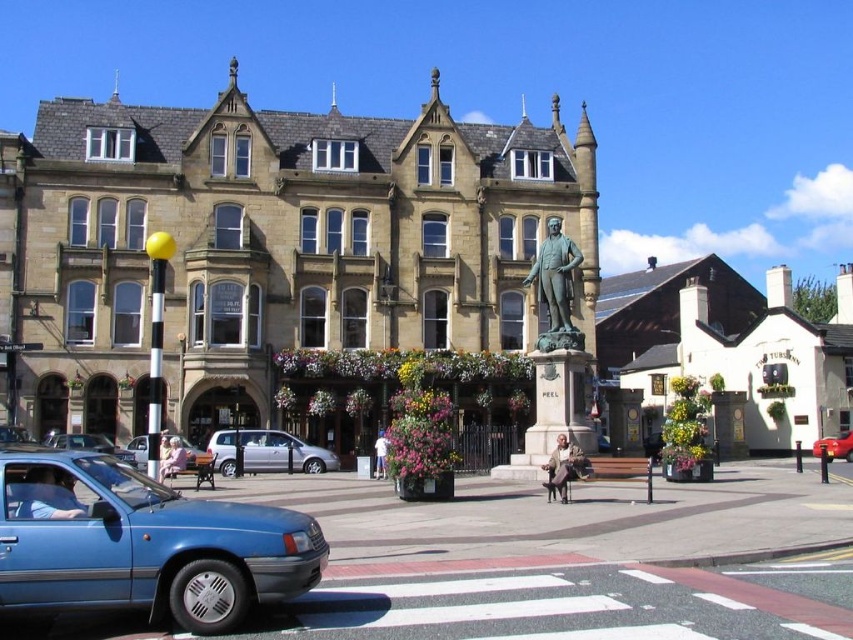
Does bronze statue at center have a greater height compared to blue metallic car at center?

Yes, bronze statue at center is taller than blue metallic car at center.

Describe the element at coordinates (556, 288) in the screenshot. I see `bronze statue at center` at that location.

Identify the location of bronze statue at center. (556, 288).

Is point (554, 340) less distant than point (834, 456)?

Yes, point (554, 340) is closer to viewer.

Locate an element on the screen. bronze statue at center is located at coordinates (556, 288).

Based on the photo, who is more distant from viewer, (572,253) or (816,449)?

Point (816,449)

At what (x,y) coordinates should I click in order to perform the action: click on bronze statue at center. Please return your answer as a coordinate pair (x, y). Looking at the image, I should click on (556, 288).

Is blue metallic car at lower left above blue metallic car at center?

Yes, blue metallic car at lower left is above blue metallic car at center.

Based on the photo, between blue metallic car at lower left and blue metallic car at center, which one is positioned lower?

Positioned lower is blue metallic car at center.

Does point (88, 433) come farther from viewer compared to point (201, 451)?

Yes, it is behind point (201, 451).

At what (x,y) coordinates should I click in order to perform the action: click on blue metallic car at lower left. Please return your answer as a coordinate pair (x, y). This screenshot has height=640, width=853. Looking at the image, I should click on (90, 445).